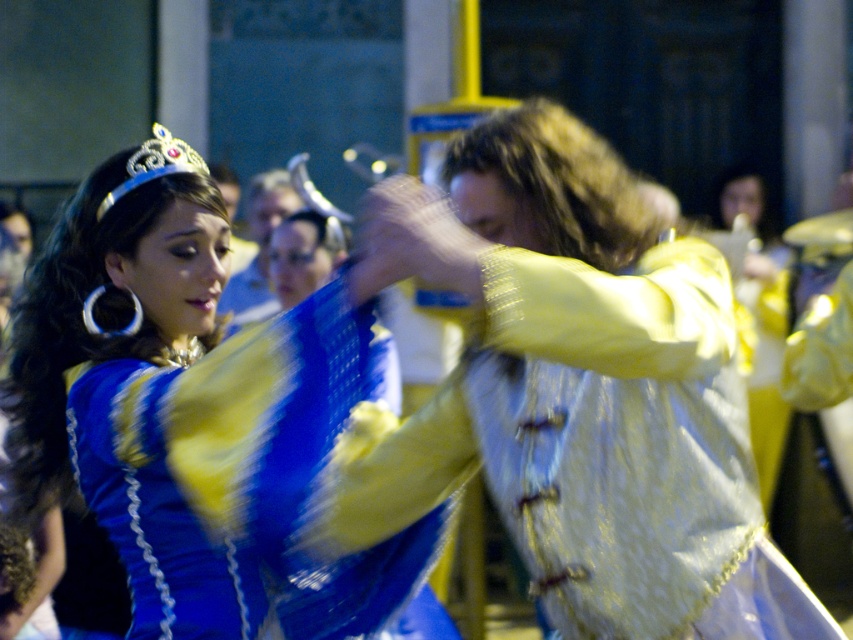
Question: Is the position of shiny blue fabric at center more distant than that of silver metallic crown at upper left?

Choices:
 (A) yes
 (B) no

Answer: (B)

Question: Can you confirm if blue satin dress at left is bigger than silver metallic crown at upper left?

Choices:
 (A) no
 (B) yes

Answer: (A)

Question: Which of the following is the farthest from the observer?

Choices:
 (A) blue satin dress at left
 (B) silver metallic crown at upper left

Answer: (B)

Question: Among these objects, which one is farthest from the camera?

Choices:
 (A) shiny blue fabric at center
 (B) silver metallic crown at upper left
 (C) blue satin dress at left

Answer: (B)

Question: Does shiny blue fabric at center appear over blue satin dress at left?

Choices:
 (A) no
 (B) yes

Answer: (B)

Question: Among these points, which one is nearest to the camera?

Choices:
 (A) (711, 412)
 (B) (148, 168)
 (C) (305, 460)

Answer: (C)